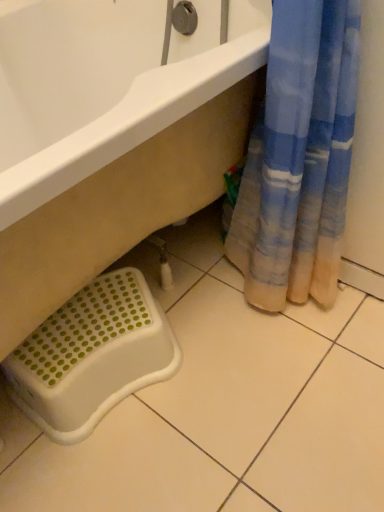
Describe the element at coordinates (92, 356) in the screenshot. This screenshot has height=512, width=384. I see `white plastic step stool at lower left` at that location.

What is the approximate height of white plastic step stool at lower left?

white plastic step stool at lower left is 8.90 inches in height.

Where is `white plastic step stool at lower left`? white plastic step stool at lower left is located at coordinates (92, 356).

Locate an element on the screen. Image resolution: width=384 pixels, height=512 pixels. white plastic bathtub at lower left is located at coordinates (110, 135).

Looking at this image, in order to face white plastic bathtub at lower left, should I rotate leftwards or rightwards?

To face it directly, rotate left by 16.348 degrees.

This screenshot has height=512, width=384. What do you see at coordinates (110, 135) in the screenshot?
I see `white plastic bathtub at lower left` at bounding box center [110, 135].

Image resolution: width=384 pixels, height=512 pixels. Find the location of `white plastic step stool at lower left`. white plastic step stool at lower left is located at coordinates (92, 356).

Is white plastic bathtub at lower left at the right side of white plastic step stool at lower left?

No.

Is white plastic bathtub at lower left closer to the viewer compared to white plastic step stool at lower left?

Yes, it is.

Is point (143, 147) closer to viewer compared to point (99, 369)?

Yes.

From the image's perspective, which object appears higher, white plastic bathtub at lower left or white plastic step stool at lower left?

white plastic bathtub at lower left appears higher in the image.

From a real-world perspective, which object rests below the other?

white plastic step stool at lower left.

Considering the sizes of objects white plastic bathtub at lower left and white plastic step stool at lower left in the image provided, who is wider, white plastic bathtub at lower left or white plastic step stool at lower left?

white plastic bathtub at lower left.

Who is taller, white plastic bathtub at lower left or white plastic step stool at lower left?

Standing taller between the two is white plastic bathtub at lower left.

Between white plastic bathtub at lower left and white plastic step stool at lower left, which one has larger size?

With larger size is white plastic bathtub at lower left.

Consider the image. Would you say white plastic bathtub at lower left is outside white plastic step stool at lower left?

Indeed, white plastic bathtub at lower left is completely outside white plastic step stool at lower left.

In the scene shown: Is there a large distance between white plastic bathtub at lower left and white plastic step stool at lower left?

No, there isn't a large distance between white plastic bathtub at lower left and white plastic step stool at lower left.

Could you tell me if white plastic bathtub at lower left is turned towards white plastic step stool at lower left?

Yes, white plastic bathtub at lower left is oriented towards white plastic step stool at lower left.

Find the location of a particular element. The image size is (384, 512). bathtub on the left of white plastic step stool at lower left is located at coordinates (110, 135).

Which is more to the left, white plastic step stool at lower left or white plastic bathtub at lower left?

white plastic bathtub at lower left is more to the left.

Considering the positions of objects white plastic step stool at lower left and white plastic bathtub at lower left in the image provided, who is behind, white plastic step stool at lower left or white plastic bathtub at lower left?

Positioned behind is white plastic step stool at lower left.

Does point (180, 359) appear closer or farther from the camera than point (94, 54)?

Point (180, 359).

From the image's perspective, between white plastic step stool at lower left and white plastic bathtub at lower left, which one is located above?

From the image's view, white plastic bathtub at lower left is above.

From a real-world perspective, which is physically above, white plastic step stool at lower left or white plastic bathtub at lower left?

white plastic bathtub at lower left, from a real-world perspective.

Considering the relative sizes of white plastic step stool at lower left and white plastic bathtub at lower left in the image provided, is white plastic step stool at lower left wider than white plastic bathtub at lower left?

Incorrect, the width of white plastic step stool at lower left does not surpass that of white plastic bathtub at lower left.

Does white plastic step stool at lower left have a greater height compared to white plastic bathtub at lower left?

Incorrect, the height of white plastic step stool at lower left is not larger of that of white plastic bathtub at lower left.

Considering the sizes of white plastic step stool at lower left and white plastic bathtub at lower left in the image, is white plastic step stool at lower left bigger or smaller than white plastic bathtub at lower left?

Clearly, white plastic step stool at lower left is smaller in size than white plastic bathtub at lower left.

Would you say white plastic bathtub at lower left is part of white plastic step stool at lower left's contents?

Actually, white plastic bathtub at lower left is outside white plastic step stool at lower left.

Is there a large distance between white plastic step stool at lower left and white plastic bathtub at lower left?

Actually, white plastic step stool at lower left and white plastic bathtub at lower left are a little close together.

Does white plastic step stool at lower left turn towards white plastic bathtub at lower left?

Yes, white plastic step stool at lower left is turned towards white plastic bathtub at lower left.

How far apart are white plastic step stool at lower left and white plastic bathtub at lower left?

The distance of white plastic step stool at lower left from white plastic bathtub at lower left is 10.19 inches.

The height and width of the screenshot is (512, 384). Find the location of `laundry basket that appears below the white plastic bathtub at lower left (from the image's perspective)`. laundry basket that appears below the white plastic bathtub at lower left (from the image's perspective) is located at coordinates (92, 356).

In the image, there is a white plastic step stool at lower left. At what (x,y) coordinates should I click in order to perform the action: click on bathtub above it (from the image's perspective). Please return your answer as a coordinate pair (x, y). This screenshot has width=384, height=512. Looking at the image, I should click on (110, 135).

Locate an element on the screen. bathtub that appears in front of the white plastic step stool at lower left is located at coordinates (110, 135).